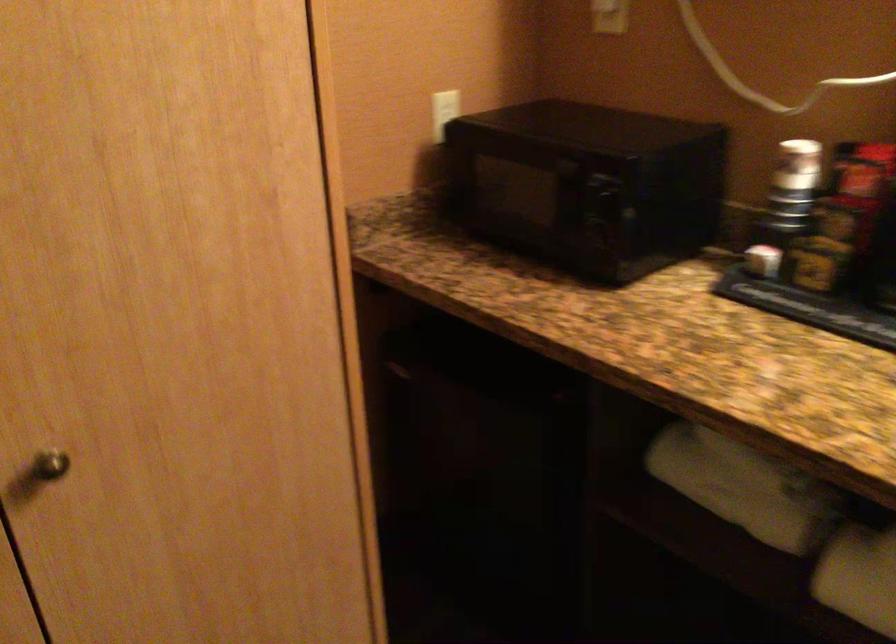
Find where to turn the cabinet door knob. Please return your answer as a coordinate pair (x, y).

(49, 465)